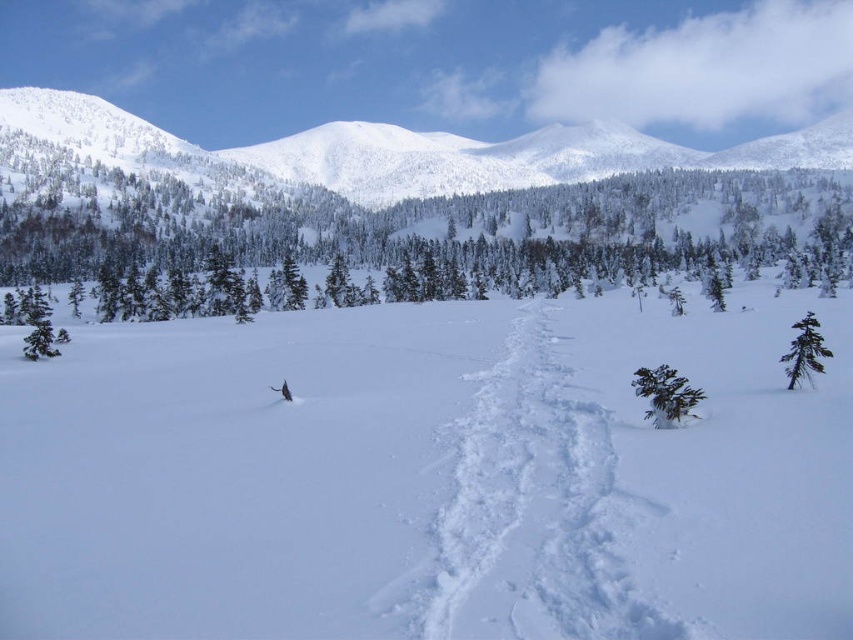
Does white snow-covered mountain at upper center appear on the right side of green matte tree at left?

Indeed, white snow-covered mountain at upper center is positioned on the right side of green matte tree at left.

Is white snow-covered mountain at upper center bigger than green matte tree at left?

Indeed, white snow-covered mountain at upper center has a larger size compared to green matte tree at left.

Is point (595, 177) farther from viewer compared to point (24, 305)?

Yes.

Locate an element on the screen. The image size is (853, 640). white snow-covered mountain at upper center is located at coordinates (409, 150).

Between white snow at center and green matte tree at right, which one is positioned higher?

green matte tree at right

Is white snow at center to the right of green matte tree at right from the viewer's perspective?

In fact, white snow at center is to the left of green matte tree at right.

Does point (648, 458) come in front of point (811, 332)?

Yes, it is in front of point (811, 332).

You are a GUI agent. You are given a task and a screenshot of the screen. Output one action in this format:
    pyautogui.click(x=<x>, y=<y>)
    Task: Click on the white snow at center
    The height and width of the screenshot is (640, 853).
    Given the screenshot: What is the action you would take?
    pyautogui.click(x=428, y=477)

Does green matte tree at center have a lesser width compared to green matte tree at right?

Yes.

Does green matte tree at center have a greater height compared to green matte tree at right?

No, green matte tree at center is not taller than green matte tree at right.

Is point (669, 392) positioned behind point (807, 330)?

That is False.

Where is `green matte tree at center`? Image resolution: width=853 pixels, height=640 pixels. green matte tree at center is located at coordinates (665, 394).